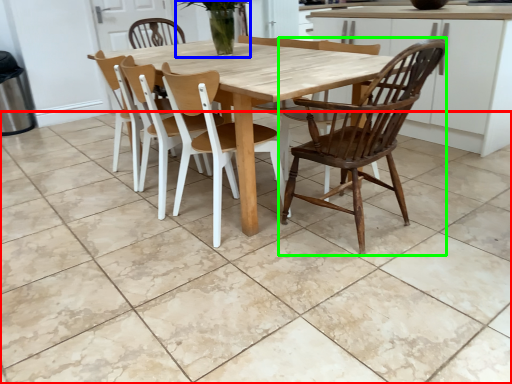
Question: Estimate the real-world distances between objects in this image. Which object is closer to tile (highlighted by a red box), plant (highlighted by a blue box) or chair (highlighted by a green box)?

Choices:
 (A) plant
 (B) chair

Answer: (B)